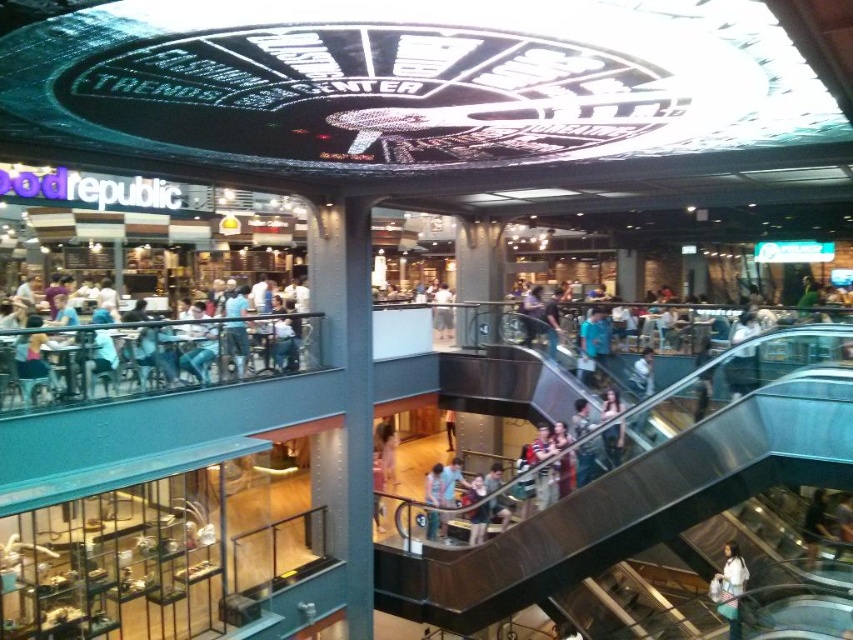
Measure the distance from light blue denim jeans at center to light brown leather jacket at center.

The distance of light blue denim jeans at center from light brown leather jacket at center is 5.01 feet.

Describe the element at coordinates (534, 476) in the screenshot. I see `light blue denim jeans at center` at that location.

Is point (560, 468) in front of point (480, 536)?

Yes, it is.

At what (x,y) coordinates should I click in order to perform the action: click on light blue denim jeans at center. Please return your answer as a coordinate pair (x, y). Looking at the image, I should click on (534, 476).

Consider the image. Can you confirm if metallic escalator at center is wider than blue denim jeans at upper left?

Indeed, metallic escalator at center has a greater width compared to blue denim jeans at upper left.

Can you confirm if metallic escalator at center is shorter than blue denim jeans at upper left?

In fact, metallic escalator at center may be taller than blue denim jeans at upper left.

The image size is (853, 640). Identify the location of metallic escalator at center. (631, 506).

Is white fabric bag at lower right in front of light brown leather jacket at center?

Yes, it is.

Who is positioned more to the right, white fabric bag at lower right or light brown leather jacket at center?

Positioned to the right is white fabric bag at lower right.

Does point (727, 609) come behind point (480, 484)?

No, it is in front of (480, 484).

Find the location of `white fabric bag at lower right`. white fabric bag at lower right is located at coordinates (729, 588).